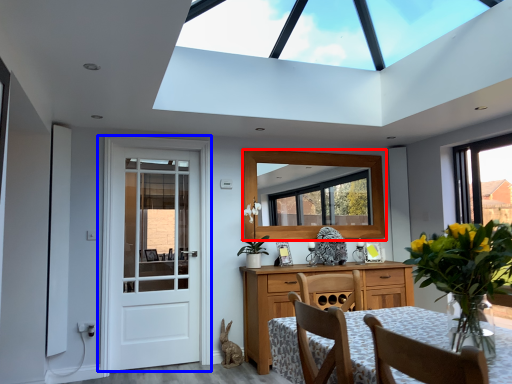
Question: Which point is closer to the camera, window (highlighted by a red box) or door (highlighted by a blue box)?

Choices:
 (A) window
 (B) door

Answer: (B)